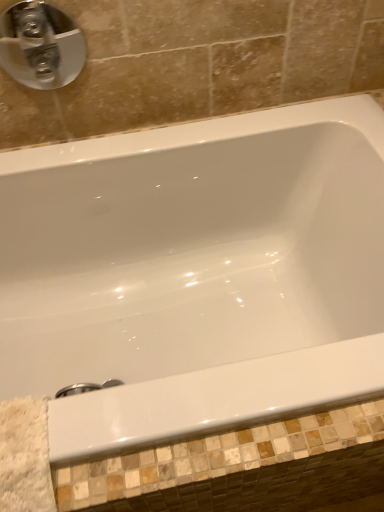
Question: Is white glossy bathtub at center wider or thinner than satin nickel faucet at upper left?

Choices:
 (A) wide
 (B) thin

Answer: (A)

Question: Is white glossy bathtub at center bigger or smaller than satin nickel faucet at upper left?

Choices:
 (A) small
 (B) big

Answer: (B)

Question: From a real-world perspective, relative to satin nickel faucet at upper left, is white glossy bathtub at center vertically above or below?

Choices:
 (A) below
 (B) above

Answer: (A)

Question: In the image, is satin nickel faucet at upper left positioned in front of or behind white glossy bathtub at center?

Choices:
 (A) front
 (B) behind

Answer: (B)

Question: Is satin nickel faucet at upper left wider or thinner than white glossy bathtub at center?

Choices:
 (A) wide
 (B) thin

Answer: (B)

Question: Is point (31, 50) positioned closer to the camera than point (230, 388)?

Choices:
 (A) closer
 (B) farther

Answer: (B)

Question: From the image's perspective, relative to white glossy bathtub at center, is satin nickel faucet at upper left above or below?

Choices:
 (A) above
 (B) below

Answer: (A)